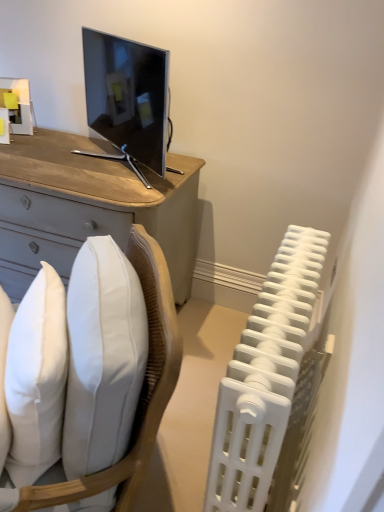
Question: Considering the relative sizes of white soft pillow at lower left and white fabric chair at lower left in the image provided, is white soft pillow at lower left smaller than white fabric chair at lower left?

Choices:
 (A) yes
 (B) no

Answer: (A)

Question: Are white soft pillow at lower left and white fabric chair at lower left beside each other?

Choices:
 (A) yes
 (B) no

Answer: (B)

Question: Is white soft pillow at lower left aimed at white fabric chair at lower left?

Choices:
 (A) yes
 (B) no

Answer: (A)

Question: From the image's perspective, is white soft pillow at lower left located beneath white fabric chair at lower left?

Choices:
 (A) yes
 (B) no

Answer: (B)

Question: Does white soft pillow at lower left have a lesser height compared to white fabric chair at lower left?

Choices:
 (A) no
 (B) yes

Answer: (B)

Question: From the image's perspective, is white soft pillow at lower left over white fabric chair at lower left?

Choices:
 (A) no
 (B) yes

Answer: (B)

Question: Is white plastic radiator at right at the right side of white soft pillow at lower left?

Choices:
 (A) no
 (B) yes

Answer: (B)

Question: From a real-world perspective, is white plastic radiator at right located beneath white soft pillow at lower left?

Choices:
 (A) no
 (B) yes

Answer: (B)

Question: Can you confirm if white plastic radiator at right is smaller than white soft pillow at lower left?

Choices:
 (A) yes
 (B) no

Answer: (B)

Question: Can you confirm if white plastic radiator at right is wider than white soft pillow at lower left?

Choices:
 (A) yes
 (B) no

Answer: (B)

Question: Is white plastic radiator at right with white soft pillow at lower left?

Choices:
 (A) yes
 (B) no

Answer: (B)

Question: Is white plastic radiator at right closer to the viewer compared to white soft pillow at lower left?

Choices:
 (A) yes
 (B) no

Answer: (A)

Question: Does white fabric chair at lower left appear on the left side of white plastic radiator at right?

Choices:
 (A) no
 (B) yes

Answer: (B)